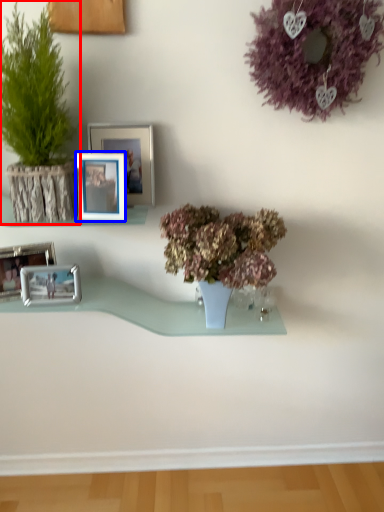
Question: Among these objects, which one is farthest to the camera, houseplant (highlighted by a red box) or picture frame (highlighted by a blue box)?

Choices:
 (A) houseplant
 (B) picture frame

Answer: (B)